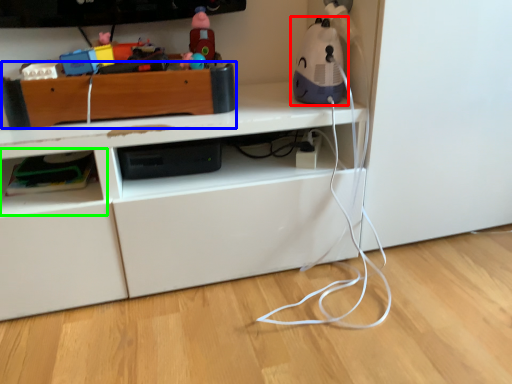
Question: Which is nearer to the toy (highlighted by a red box)? shelf (highlighted by a blue box) or shelf (highlighted by a green box).

Choices:
 (A) shelf
 (B) shelf

Answer: (A)